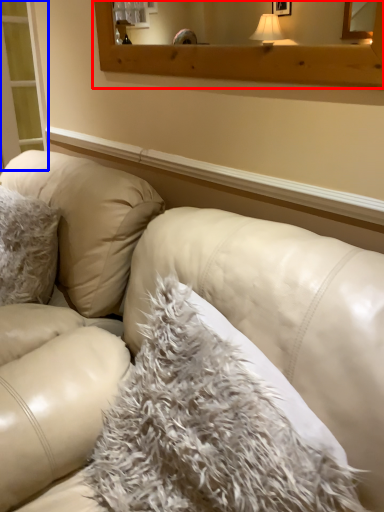
Question: Which of the following is the closest to the observer, window frame (highlighted by a red box) or screen door (highlighted by a blue box)?

Choices:
 (A) window frame
 (B) screen door

Answer: (A)